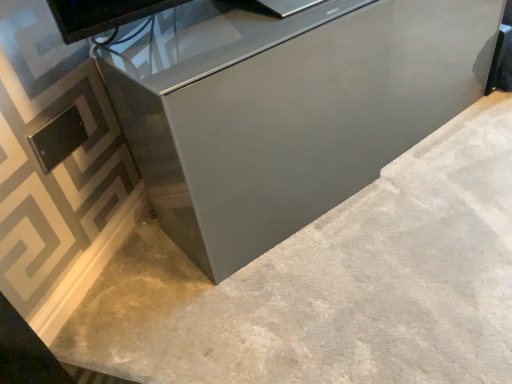
Question: In terms of size, does gray polished concrete at center appear bigger or smaller than satin gray cabinet at center?

Choices:
 (A) big
 (B) small

Answer: (B)

Question: Is gray polished concrete at center taller or shorter than satin gray cabinet at center?

Choices:
 (A) tall
 (B) short

Answer: (B)

Question: Is gray polished concrete at center wider or thinner than satin gray cabinet at center?

Choices:
 (A) wide
 (B) thin

Answer: (A)

Question: From a real-world perspective, is satin gray cabinet at center physically located above or below gray polished concrete at center?

Choices:
 (A) below
 (B) above

Answer: (B)

Question: Looking at their shapes, would you say satin gray cabinet at center is wider or thinner than gray polished concrete at center?

Choices:
 (A) wide
 (B) thin

Answer: (B)

Question: Is satin gray cabinet at center inside the boundaries of gray polished concrete at center, or outside?

Choices:
 (A) outside
 (B) inside

Answer: (A)

Question: Based on their sizes in the image, would you say satin gray cabinet at center is bigger or smaller than gray polished concrete at center?

Choices:
 (A) small
 (B) big

Answer: (B)